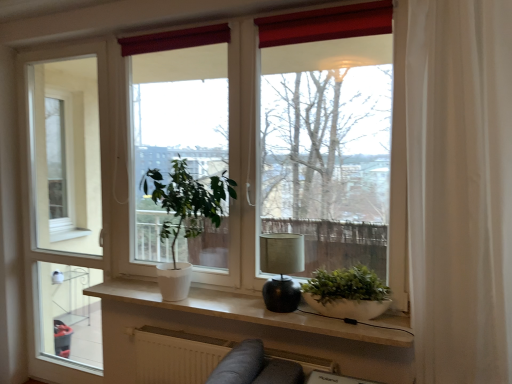
Question: From a real-world perspective, is white matte radiator at lower center positioned above or below matte black lamp at center?

Choices:
 (A) below
 (B) above

Answer: (A)

Question: Is white matte radiator at lower center taller or shorter than matte black lamp at center?

Choices:
 (A) short
 (B) tall

Answer: (A)

Question: Based on their relative distances, which object is nearer to the white matte window sill at center?

Choices:
 (A) white matte radiator at lower center
 (B) white glossy screen door at left
 (C) white matte plant at center, which is the 1th houseplant from left to right
 (D) white sheer curtain at right
 (E) white matte window at center

Answer: (A)

Question: Estimate the real-world distances between objects in this image. Which object is closer to the green matte plant at center, which appears as the 2th houseplant when viewed from the left?

Choices:
 (A) white glossy screen door at left
 (B) white matte window sill at center
 (C) white matte plant at center, which is the 1th houseplant from left to right
 (D) white matte window at center
 (E) white matte radiator at lower center

Answer: (B)